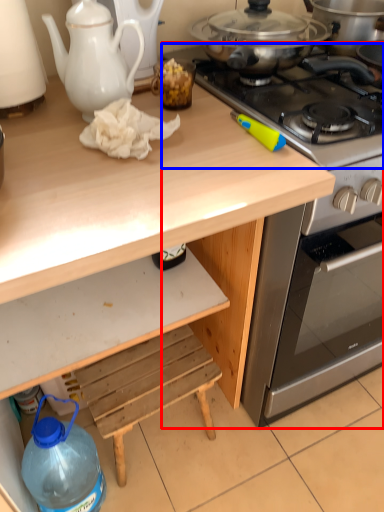
Question: Which of the following is the farthest to the observer, oven (highlighted by a red box) or gas stove (highlighted by a blue box)?

Choices:
 (A) oven
 (B) gas stove

Answer: (A)